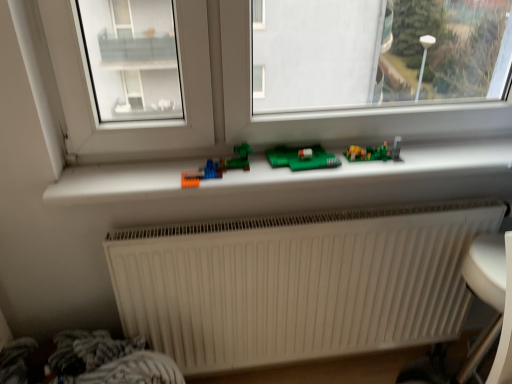
Question: Is white ribbed radiator at lower center next to white plastic window sill at center and touching it?

Choices:
 (A) no
 (B) yes

Answer: (A)

Question: Could you tell me if white ribbed radiator at lower center is turned towards white plastic window sill at center?

Choices:
 (A) yes
 (B) no

Answer: (B)

Question: Is white plastic window sill at center at the back of white ribbed radiator at lower center?

Choices:
 (A) yes
 (B) no

Answer: (B)

Question: Can you confirm if white ribbed radiator at lower center is positioned to the right of white plastic window sill at center?

Choices:
 (A) no
 (B) yes

Answer: (A)

Question: Is white ribbed radiator at lower center not near white plastic window sill at center?

Choices:
 (A) no
 (B) yes

Answer: (A)

Question: Considering the positions of point (181, 187) and point (397, 152), is point (181, 187) closer or farther from the camera than point (397, 152)?

Choices:
 (A) farther
 (B) closer

Answer: (B)

Question: In terms of size, does translucent plastic toy at center, which appears as the 1th toy when viewed from the front, appear bigger or smaller than matte plastic toy at center, which is the 1th toy from right to left?

Choices:
 (A) big
 (B) small

Answer: (A)

Question: From the image's perspective, is translucent plastic toy at center, the 2th toy from the right, above or below matte plastic toy at center, marked as the 2th toy in a left-to-right arrangement?

Choices:
 (A) below
 (B) above

Answer: (A)

Question: Considering the positions of translucent plastic toy at center, which ranks as the 2th toy in back-to-front order, and matte plastic toy at center, marked as the 2th toy in a left-to-right arrangement, in the image, is translucent plastic toy at center, which ranks as the 2th toy in back-to-front order, wider or thinner than matte plastic toy at center, marked as the 2th toy in a left-to-right arrangement,?

Choices:
 (A) thin
 (B) wide

Answer: (A)

Question: Is white ribbed radiator at lower center in front of or behind white plastic armchair at lower right in the image?

Choices:
 (A) behind
 (B) front

Answer: (A)

Question: From a real-world perspective, is white ribbed radiator at lower center above or below white plastic armchair at lower right?

Choices:
 (A) above
 (B) below

Answer: (A)

Question: Based on their sizes in the image, would you say white ribbed radiator at lower center is bigger or smaller than white plastic armchair at lower right?

Choices:
 (A) big
 (B) small

Answer: (B)

Question: Is white ribbed radiator at lower center wider or thinner than white plastic armchair at lower right?

Choices:
 (A) wide
 (B) thin

Answer: (B)

Question: Is white plastic window sill at center in front of or behind white ribbed radiator at lower center in the image?

Choices:
 (A) behind
 (B) front

Answer: (B)

Question: Is white plastic window sill at center inside or outside of white ribbed radiator at lower center?

Choices:
 (A) inside
 (B) outside

Answer: (B)